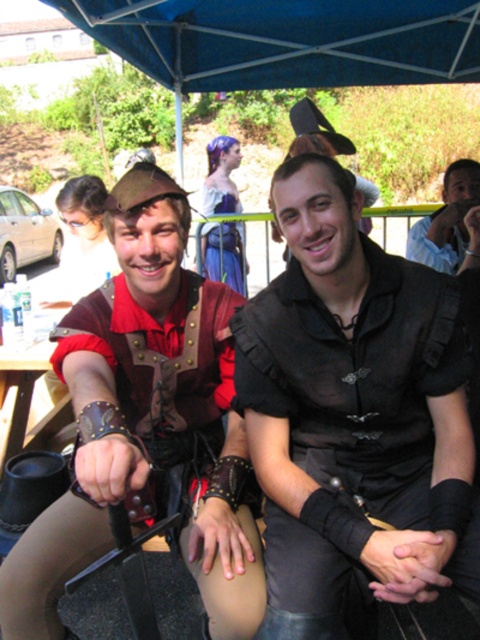
You are taking a photo of two people under a blue canopy tent. You notice two specific points marked in the image. The first point is at coordinates point (367, 362) and the second point is at point (414, 13). Which of these two points is closer to the camera?

Point (367, 362) is closer to the camera than point (414, 13).

You are a costume designer preparing for a play. You have two shirts available for the main character. The black matte shirt at center and the light blue shirt at center. The director wants to choose the shirt that takes up more visual space in the scene. Which shirt should you recommend?

The light blue shirt at center should be recommended because it occupies more space than the black matte shirt at center.